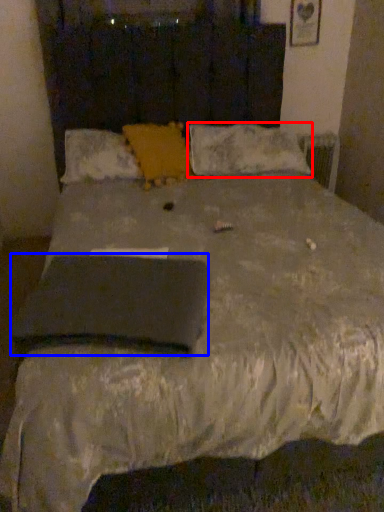
Question: Which object is closer to the camera taking this photo, pillow (highlighted by a red box) or pad (highlighted by a blue box)?

Choices:
 (A) pillow
 (B) pad

Answer: (B)